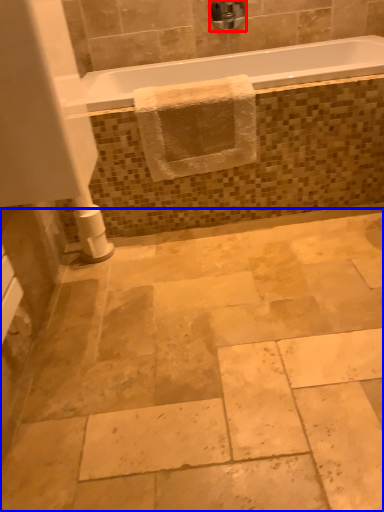
Question: Which object appears closest to the camera in this image, faucet (highlighted by a red box) or ceramic tile (highlighted by a blue box)?

Choices:
 (A) faucet
 (B) ceramic tile

Answer: (B)